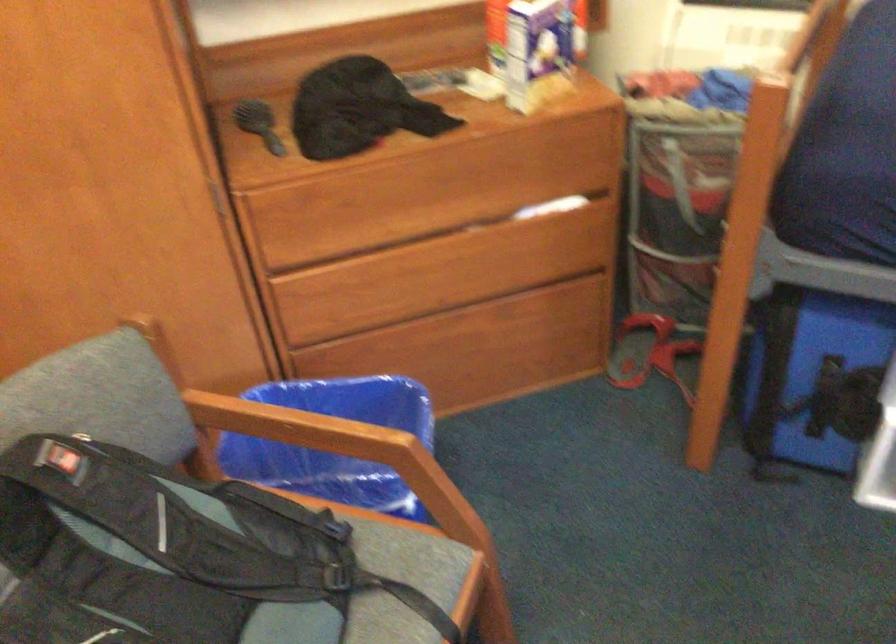
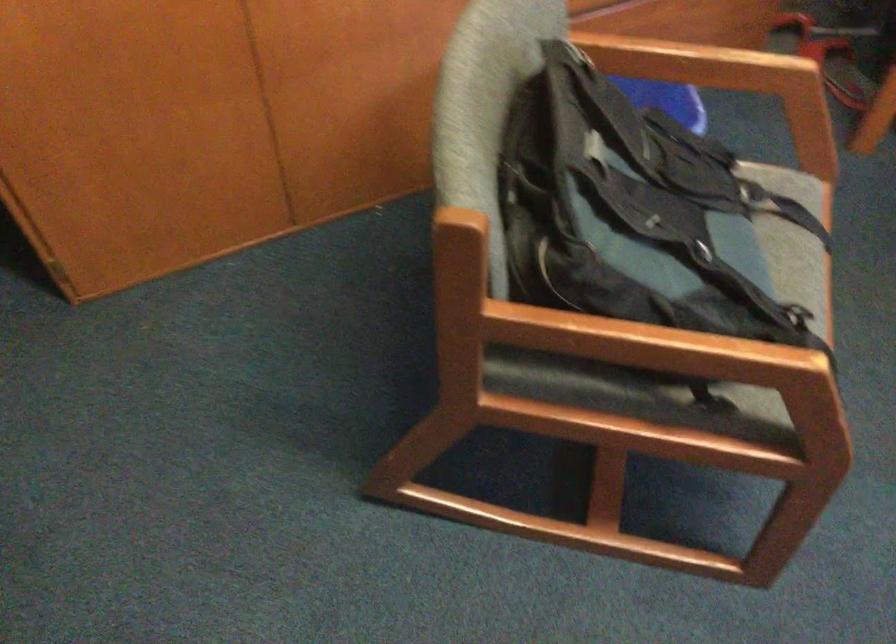
Question: The images are taken continuously from a first-person perspective. In which direction are you moving?

Choices:
 (A) Left
 (B) Right
 (C) Forward
 (D) Backward

Answer: (A)